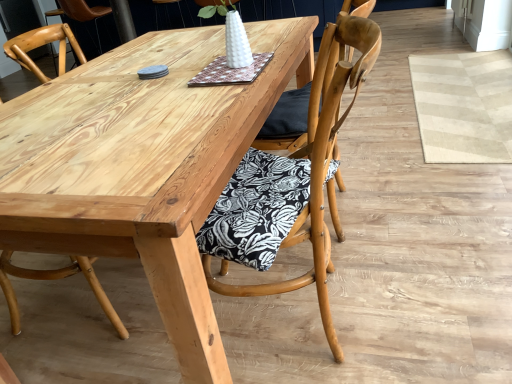
You are a GUI agent. You are given a task and a screenshot of the screen. Output one action in this format:
    pyautogui.click(x=<x>, y=<y>)
    Task: Click on the natural wood table at center
    The width and height of the screenshot is (512, 384).
    Given the screenshot: What is the action you would take?
    pyautogui.click(x=143, y=165)

What do you see at coordinates (143, 165) in the screenshot? I see `natural wood table at center` at bounding box center [143, 165].

Find the location of a particular element. This screenshot has height=384, width=512. natural wood table at center is located at coordinates (143, 165).